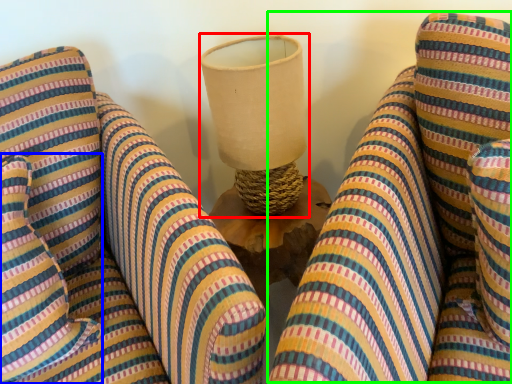
Question: Which object is the closest to the table lamp (highlighted by a red box)? Choose among these: pillow (highlighted by a blue box) or bean bag chair (highlighted by a green box).

Choices:
 (A) pillow
 (B) bean bag chair

Answer: (B)